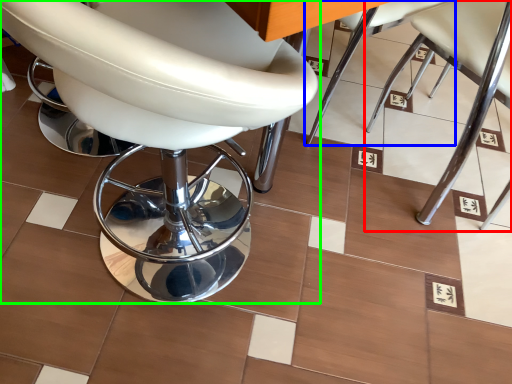
Question: Based on their relative distances, which object is farther from chair (highlighted by a red box)? Choose from chair (highlighted by a blue box) and chair (highlighted by a green box).

Choices:
 (A) chair
 (B) chair

Answer: (B)